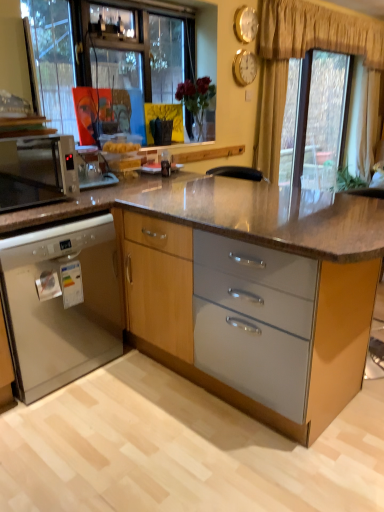
The image size is (384, 512). Describe the element at coordinates (244, 67) in the screenshot. I see `gold metallic clock at upper center, which ranks as the first clock in bottom-to-top order` at that location.

The width and height of the screenshot is (384, 512). What do you see at coordinates (315, 120) in the screenshot? I see `transparent glass window at upper right` at bounding box center [315, 120].

What do you see at coordinates (37, 170) in the screenshot?
I see `satin black microwave at left` at bounding box center [37, 170].

What do you see at coordinates (243, 298) in the screenshot? I see `matte wood cabinet at center, the 1th cabinetry in the right-to-left sequence` at bounding box center [243, 298].

Where is `gold textured curtain at upper center`? gold textured curtain at upper center is located at coordinates (318, 32).

Where is `gold metallic clock at upper center, the first clock positioned from the top`? This screenshot has width=384, height=512. gold metallic clock at upper center, the first clock positioned from the top is located at coordinates (246, 24).

Is gold textured curtain at upper center wider or thinner than transparent glass window at upper right?

Clearly, gold textured curtain at upper center has more width compared to transparent glass window at upper right.

Considering the relative sizes of gold textured curtain at upper center and transparent glass window at upper right in the image provided, is gold textured curtain at upper center bigger than transparent glass window at upper right?

Yes, gold textured curtain at upper center is bigger than transparent glass window at upper right.

Identify the location of curtain that is above the transparent glass window at upper right (from a real-world perspective). The width and height of the screenshot is (384, 512). (318, 32).

Is gold textured curtain at upper center not inside transparent glass window at upper right?

Yes, gold textured curtain at upper center is located beyond the bounds of transparent glass window at upper right.

Could you measure the distance between gold metallic clock at upper center, which ranks as the first clock in bottom-to-top order, and gold metallic clock at upper center, arranged as the 2th clock when ordered from the bottom?

gold metallic clock at upper center, which ranks as the first clock in bottom-to-top order, and gold metallic clock at upper center, arranged as the 2th clock when ordered from the bottom, are 7.99 inches apart from each other.

From the image's perspective, who appears lower, gold metallic clock at upper center, which ranks as the second clock in top-to-bottom order, or gold metallic clock at upper center, arranged as the 2th clock when ordered from the bottom?

gold metallic clock at upper center, which ranks as the second clock in top-to-bottom order, from the image's perspective.

Is gold metallic clock at upper center, which ranks as the first clock in bottom-to-top order, facing away from gold metallic clock at upper center, arranged as the 2th clock when ordered from the bottom?

gold metallic clock at upper center, which ranks as the first clock in bottom-to-top order, is not turned away from gold metallic clock at upper center, arranged as the 2th clock when ordered from the bottom.

Based on the photo, considering the sizes of objects gold metallic clock at upper center, which ranks as the second clock in top-to-bottom order, and gold metallic clock at upper center, arranged as the 2th clock when ordered from the bottom, in the image provided, who is smaller, gold metallic clock at upper center, which ranks as the second clock in top-to-bottom order, or gold metallic clock at upper center, arranged as the 2th clock when ordered from the bottom,?

gold metallic clock at upper center, arranged as the 2th clock when ordered from the bottom.

Based on the photo, which object is further away from the camera taking this photo, gold metallic clock at upper center, the first clock positioned from the top, or gold metallic clock at upper center, which ranks as the second clock in top-to-bottom order?

gold metallic clock at upper center, which ranks as the second clock in top-to-bottom order, is further from the camera.

Does gold metallic clock at upper center, arranged as the 2th clock when ordered from the bottom, have a lesser height compared to gold metallic clock at upper center, which ranks as the second clock in top-to-bottom order?

Yes.

From the image's perspective, is gold metallic clock at upper center, the first clock positioned from the top, located beneath gold metallic clock at upper center, which ranks as the second clock in top-to-bottom order?

Actually, gold metallic clock at upper center, the first clock positioned from the top, appears above gold metallic clock at upper center, which ranks as the second clock in top-to-bottom order, in the image.

Which point is more forward, (242, 39) or (238, 68)?

Point (242, 39)

Between gold metallic clock at upper center, the first clock positioned from the top, and white glossy dishwasher at lower left, which is counted as the 1th cabinetry, starting from the left, which one has more height?

With more height is white glossy dishwasher at lower left, which is counted as the 1th cabinetry, starting from the left.

Considering the positions of point (241, 32) and point (42, 271), is point (241, 32) closer or farther from the camera than point (42, 271)?

Point (241, 32) is farther from the camera than point (42, 271).

How much distance is there between gold metallic clock at upper center, the first clock positioned from the top, and white glossy dishwasher at lower left, which is counted as the 1th cabinetry, starting from the left?

gold metallic clock at upper center, the first clock positioned from the top, and white glossy dishwasher at lower left, which is counted as the 1th cabinetry, starting from the left, are 8.21 feet apart.

Identify the location of the 2nd cabinetry positioned below the gold metallic clock at upper center, arranged as the 2th clock when ordered from the bottom (from the image's perspective). The image size is (384, 512). (61, 303).

Is satin black microwave at left not close to gold textured curtain at upper center?

satin black microwave at left is positioned a significant distance from gold textured curtain at upper center.

In the scene shown: Is satin black microwave at left facing towards gold textured curtain at upper center?

No.

Consider the image. Does satin black microwave at left have a larger size compared to gold textured curtain at upper center?

No, satin black microwave at left is not bigger than gold textured curtain at upper center.

Is gold metallic clock at upper center, which ranks as the second clock in top-to-bottom order, far away from satin black microwave at left?

That's right, there is a large distance between gold metallic clock at upper center, which ranks as the second clock in top-to-bottom order, and satin black microwave at left.

From a real-world perspective, is gold metallic clock at upper center, which ranks as the second clock in top-to-bottom order, positioned over satin black microwave at left based on gravity?

Yes, from a real-world perspective, gold metallic clock at upper center, which ranks as the second clock in top-to-bottom order, is on top of satin black microwave at left.

Is gold metallic clock at upper center, which ranks as the second clock in top-to-bottom order, facing away from satin black microwave at left?

No, gold metallic clock at upper center, which ranks as the second clock in top-to-bottom order,'s orientation is not away from satin black microwave at left.

Does gold metallic clock at upper center, which ranks as the first clock in bottom-to-top order, have a larger size compared to satin black microwave at left?

No.

From the image's perspective, is satin black microwave at left located above gold metallic clock at upper center, which ranks as the second clock in top-to-bottom order?

Incorrect, from the image's perspective, satin black microwave at left is lower than gold metallic clock at upper center, which ranks as the second clock in top-to-bottom order.

Starting from the satin black microwave at left, which clock is the 2nd one to the right? Please provide its 2D coordinates.

[(244, 67)]

Is satin black microwave at left at the right side of gold metallic clock at upper center, which ranks as the second clock in top-to-bottom order?

Incorrect, satin black microwave at left is not on the right side of gold metallic clock at upper center, which ranks as the second clock in top-to-bottom order.

This screenshot has width=384, height=512. I want to click on window screen that is behind the gold textured curtain at upper center, so click(315, 120).

Locate an element on the screen. Image resolution: width=384 pixels, height=512 pixels. clock located below the gold metallic clock at upper center, the first clock positioned from the top (from the image's perspective) is located at coordinates (244, 67).

In the scene shown: Looking at the image, which one is located closer to gold textured curtain at upper center, gold metallic clock at upper center, the first clock positioned from the top, or white glossy dishwasher at lower left, which is the second cabinetry from right to left?

The object closer to gold textured curtain at upper center is gold metallic clock at upper center, the first clock positioned from the top.

Considering their positions, is transparent glass window at upper right positioned further to gold textured curtain at upper center than matte wood cabinet at center, the 2th cabinetry from the left?

matte wood cabinet at center, the 2th cabinetry from the left.

From the image, which object appears to be farther from transparent glass window at upper right, gold metallic clock at upper center, arranged as the 2th clock when ordered from the bottom, or white glossy dishwasher at lower left, which is the second cabinetry from right to left?

white glossy dishwasher at lower left, which is the second cabinetry from right to left, lies further to transparent glass window at upper right than the other object.

Based on their spatial positions, is gold textured curtain at upper center or gold metallic clock at upper center, which ranks as the first clock in bottom-to-top order, closer to matte wood cabinet at center, the 1th cabinetry in the right-to-left sequence?

gold metallic clock at upper center, which ranks as the first clock in bottom-to-top order, is closer to matte wood cabinet at center, the 1th cabinetry in the right-to-left sequence.

When comparing their distances from white glossy dishwasher at lower left, which is counted as the 1th cabinetry, starting from the left, does gold metallic clock at upper center, which ranks as the second clock in top-to-bottom order, or satin black microwave at left seem closer?

satin black microwave at left is positioned closer to the anchor white glossy dishwasher at lower left, which is counted as the 1th cabinetry, starting from the left.

Estimate the real-world distances between objects in this image. Which object is further from gold textured curtain at upper center, satin black microwave at left or gold metallic clock at upper center, the first clock positioned from the top?

satin black microwave at left lies further to gold textured curtain at upper center than the other object.

Based on their spatial positions, is matte wood cabinet at center, the 2th cabinetry from the left, or white glossy dishwasher at lower left, which is the second cabinetry from right to left, closer to transparent glass window at upper right?

Based on the image, matte wood cabinet at center, the 2th cabinetry from the left, appears to be nearer to transparent glass window at upper right.

Considering their positions, is gold metallic clock at upper center, which ranks as the first clock in bottom-to-top order, positioned closer to gold metallic clock at upper center, the first clock positioned from the top, than transparent glass window at upper right?

Among the two, gold metallic clock at upper center, which ranks as the first clock in bottom-to-top order, is located nearer to gold metallic clock at upper center, the first clock positioned from the top.

Where is `cabinetry between matte wood cabinet at center, the 1th cabinetry in the right-to-left sequence, and gold metallic clock at upper center, which ranks as the first clock in bottom-to-top order, along the z-axis`? cabinetry between matte wood cabinet at center, the 1th cabinetry in the right-to-left sequence, and gold metallic clock at upper center, which ranks as the first clock in bottom-to-top order, along the z-axis is located at coordinates (61, 303).

This screenshot has width=384, height=512. I want to click on home appliance positioned between matte wood cabinet at center, the 2th cabinetry from the left, and transparent glass window at upper right from near to far, so click(37, 170).

Find the location of a particular element. The height and width of the screenshot is (512, 384). home appliance between gold metallic clock at upper center, the first clock positioned from the top, and white glossy dishwasher at lower left, which is counted as the 1th cabinetry, starting from the left, in the vertical direction is located at coordinates (37, 170).

At what (x,y) coordinates should I click in order to perform the action: click on curtain between white glossy dishwasher at lower left, which is counted as the 1th cabinetry, starting from the left, and transparent glass window at upper right from front to back. Please return your answer as a coordinate pair (x, y). Looking at the image, I should click on (318, 32).